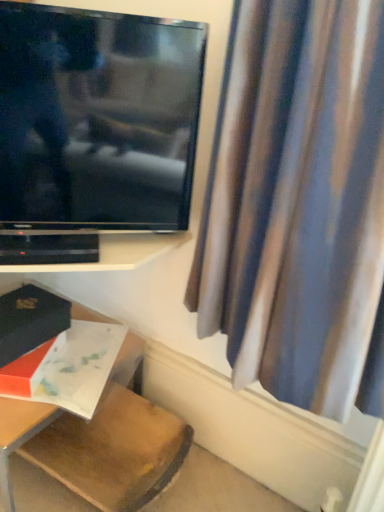
Question: Is matte black book at lower left, which is counted as the first book, starting from the top, far from black plastic shelf at lower left?

Choices:
 (A) yes
 (B) no

Answer: (B)

Question: From the image's perspective, would you say matte black book at lower left, arranged as the second book when ordered from the bottom, is positioned over black plastic shelf at lower left?

Choices:
 (A) no
 (B) yes

Answer: (A)

Question: Is matte black book at lower left, arranged as the second book when ordered from the bottom, wider than black plastic shelf at lower left?

Choices:
 (A) yes
 (B) no

Answer: (A)

Question: From a real-world perspective, does matte black book at lower left, which is counted as the first book, starting from the top, sit lower than black plastic shelf at lower left?

Choices:
 (A) no
 (B) yes

Answer: (B)

Question: Is matte black book at lower left, arranged as the second book when ordered from the bottom, next to black plastic shelf at lower left and touching it?

Choices:
 (A) no
 (B) yes

Answer: (A)

Question: Is black plastic shelf at lower left completely or partially inside matte black book at lower left, which is counted as the first book, starting from the top?

Choices:
 (A) yes
 (B) no

Answer: (B)

Question: Can you confirm if black plastic shelf at lower left is smaller than silky blue curtain at right?

Choices:
 (A) no
 (B) yes

Answer: (B)

Question: Considering the relative sizes of black plastic shelf at lower left and silky blue curtain at right in the image provided, is black plastic shelf at lower left shorter than silky blue curtain at right?

Choices:
 (A) yes
 (B) no

Answer: (A)

Question: Would you say black plastic shelf at lower left is outside silky blue curtain at right?

Choices:
 (A) yes
 (B) no

Answer: (A)

Question: From the image's perspective, is black plastic shelf at lower left over silky blue curtain at right?

Choices:
 (A) yes
 (B) no

Answer: (B)

Question: Considering the relative sizes of black plastic shelf at lower left and silky blue curtain at right in the image provided, is black plastic shelf at lower left thinner than silky blue curtain at right?

Choices:
 (A) no
 (B) yes

Answer: (B)

Question: From a real-world perspective, is black plastic shelf at lower left physically below silky blue curtain at right?

Choices:
 (A) yes
 (B) no

Answer: (A)

Question: Is matte white book at lower left, which is counted as the 2th book, starting from the top, touching flat screen tv at upper left?

Choices:
 (A) yes
 (B) no

Answer: (B)